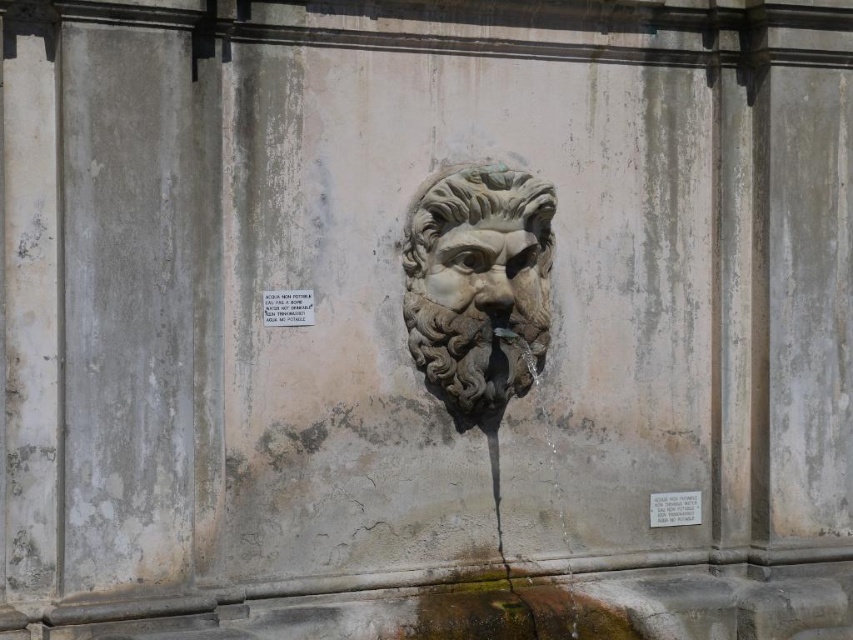
In the scene shown: Between white stone plaque at upper center and white stone plaque at center, which one appears on the right side from the viewer's perspective?

white stone plaque at center

Is white stone plaque at upper center bigger than white stone plaque at center?

Actually, white stone plaque at upper center might be smaller than white stone plaque at center.

Does point (299, 316) lie in front of point (680, 500)?

Yes, it is.

What are the coordinates of `white stone plaque at upper center` in the screenshot? It's located at (287, 307).

Is point (498, 198) positioned before point (502, 300)?

No, it is behind (502, 300).

Is white marble lion at center smaller than carved stone face at center?

Actually, white marble lion at center might be larger than carved stone face at center.

Where is `white marble lion at center`? This screenshot has height=640, width=853. white marble lion at center is located at coordinates (479, 284).

Which of these two, white marble lion at center or white stone plaque at upper center, stands shorter?

white stone plaque at upper center is shorter.

Can you confirm if white marble lion at center is positioned to the right of white stone plaque at upper center?

Correct, you'll find white marble lion at center to the right of white stone plaque at upper center.

Is point (450, 308) positioned behind point (289, 316)?

Yes, point (450, 308) is farther from viewer.

You are a GUI agent. You are given a task and a screenshot of the screen. Output one action in this format:
    pyautogui.click(x=<x>, y=<y>)
    Task: Click on the white marble lion at center
    Image resolution: width=853 pixels, height=640 pixels.
    Given the screenshot: What is the action you would take?
    pyautogui.click(x=479, y=284)